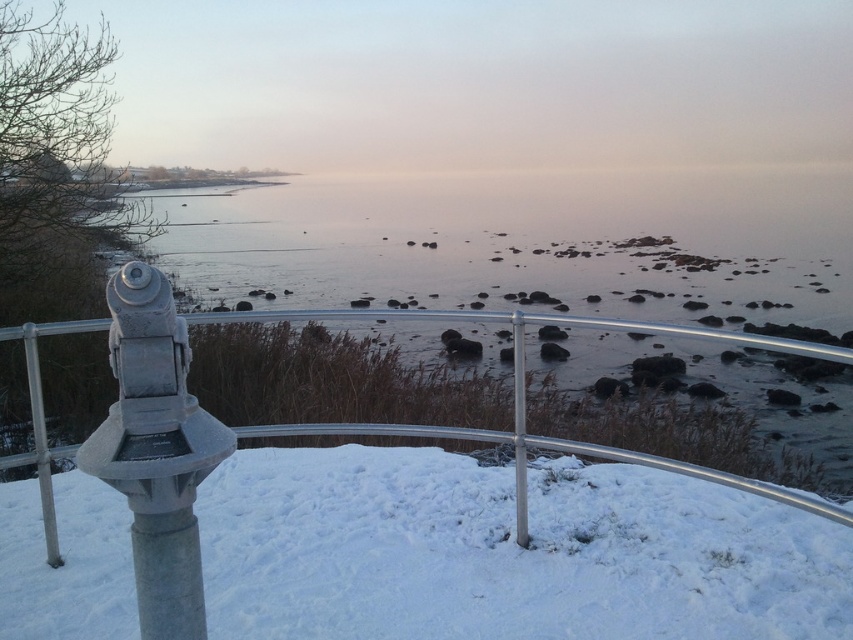
You are a photographer setting up a tripod to capture the snow and fence in the scene. The tripod requires at least 40 centimeters of space between the objects to fit your equipment. Based on the image, can you determine if there is enough space between the white fluffy snow at center and the silver metallic fence at center for your setup?

The white fluffy snow at center and silver metallic fence at center are 39.04 centimeters apart, which is less than the required 40 centimeters. Therefore, there isn not enough space for the tripod setup.

You are a visitor at this winter coastal viewpoint and want to take a photo of the silver metallic fence at center while standing on the white fluffy snow at center. Can you position yourself so that the fence is to your right side in the photo?

The white fluffy snow at center is positioned on the left side of the silver metallic fence at center. Therefore, if you stand on the white fluffy snow at center and face the fence, the fence will be to your right side in the photo.

You are standing in the winter scene and want to walk to the shoreline. The white fluffy snow at center and the silver metallic fence at center are in your path. Which object will you encounter first?

The white fluffy snow at center is located below the silver metallic fence at center, so you will encounter the silver metallic fence at center first before reaching the white fluffy snow at center.